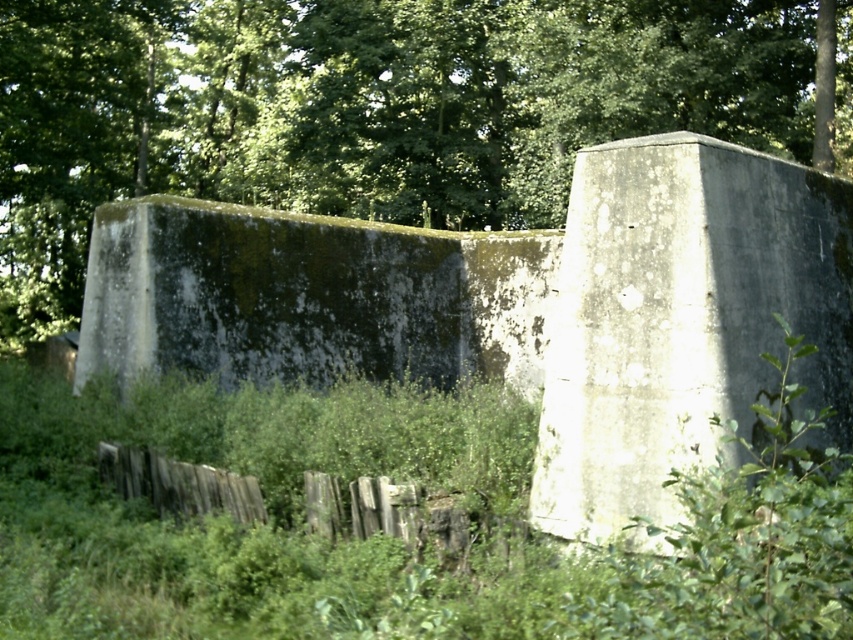
You are standing in front of the green mossy concrete wall at center and want to reach the green leafy tree at upper center. Which direction should you walk to get closer to the tree?

You should walk forward towards the green leafy tree at upper center because it is closer to you than the green mossy concrete wall at center, so moving forward will bring you nearer to the tree.

You are a bird looking for a place to perch. You see the green leafy tree at upper center and the green mossy concrete wall at center. Which one is taller?

The green leafy tree at upper center is much taller than the green mossy concrete wall at center, so the tree is taller.

You are a painter who needs to decide which object to paint first. Based on their sizes, which object should you tackle first between the gray concrete wall at center and the weathered wood fence at lower center?

The gray concrete wall at center is bigger than the weathered wood fence at lower center, so you should tackle the gray concrete wall at center first as it requires more time and effort due to its larger size.